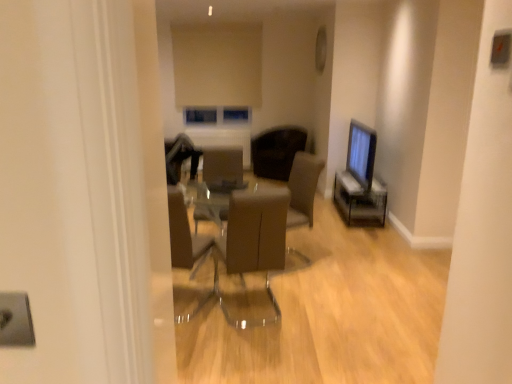
I want to click on vacant space underneath brown leather chair at center, which is counted as the second chair, starting from the top (from a real-world perspective), so click(244, 310).